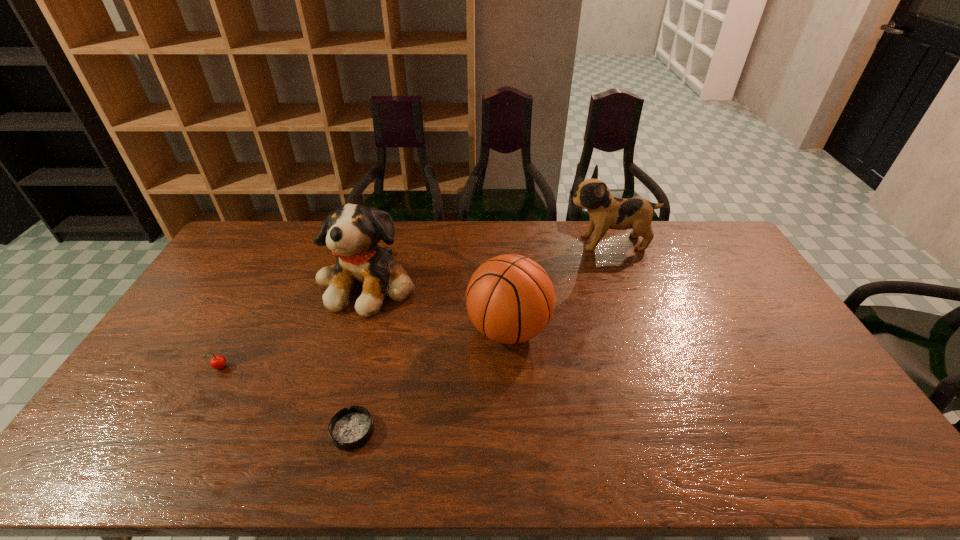
Where is `blank area located at the face of the left puppy`? Image resolution: width=960 pixels, height=540 pixels. blank area located at the face of the left puppy is located at coordinates (340, 383).

Where is `vacant space located 0.210m on the back of the basketball`? The image size is (960, 540). vacant space located 0.210m on the back of the basketball is located at coordinates (504, 261).

Where is `blank area located 0.350m on the right of the second shortest object`? The height and width of the screenshot is (540, 960). blank area located 0.350m on the right of the second shortest object is located at coordinates (350, 369).

You are a GUI agent. You are given a task and a screenshot of the screen. Output one action in this format:
    pyautogui.click(x=<x>, y=<y>)
    Task: Click on the free point located 0.060m on the left of the ashtray
    
    Given the screenshot: What is the action you would take?
    pyautogui.click(x=307, y=431)

At what (x,y) coordinates should I click in order to perform the action: click on object that is at the near edge. Please return your answer as a coordinate pair (x, y). The height and width of the screenshot is (540, 960). Looking at the image, I should click on (350, 428).

In the image, there is a desktop. Where is `vacant space at the far edge`? vacant space at the far edge is located at coordinates (430, 231).

Locate an element on the screen. This screenshot has width=960, height=540. blank space at the near edge is located at coordinates (347, 474).

Locate an element on the screen. This screenshot has width=960, height=540. free region at the left edge is located at coordinates (180, 359).

Find the location of a particular element. The height and width of the screenshot is (540, 960). vacant region at the right edge of the desktop is located at coordinates (842, 411).

What are the coordinates of `free spot at the far left corner of the desktop` in the screenshot? It's located at (263, 244).